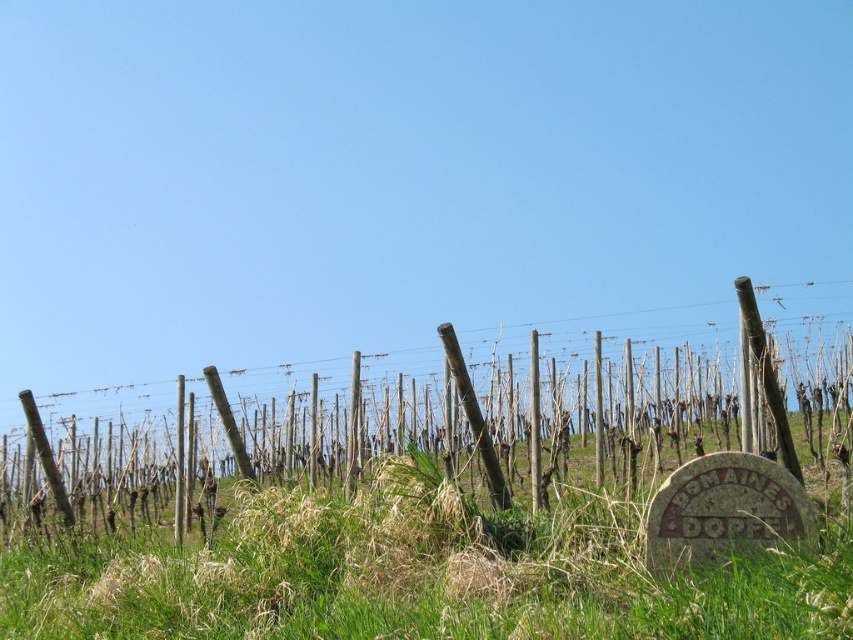
Question: Which point is closer to the camera taking this photo?

Choices:
 (A) click(480, 564)
 (B) click(57, 424)

Answer: (A)

Question: Is green grassy at center further to camera compared to brown wooden posts at center?

Choices:
 (A) no
 (B) yes

Answer: (A)

Question: Can you confirm if green grassy at center is bigger than brown wooden posts at center?

Choices:
 (A) no
 (B) yes

Answer: (A)

Question: Does green grassy at center appear on the right side of brown wooden posts at center?

Choices:
 (A) no
 (B) yes

Answer: (A)